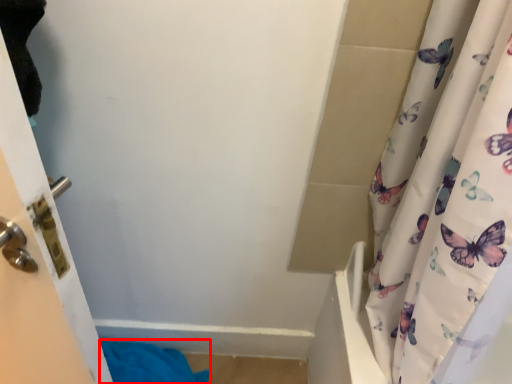
Question: In this image, where is bath towel (annotated by the red box) located relative to door?

Choices:
 (A) left
 (B) right

Answer: (B)